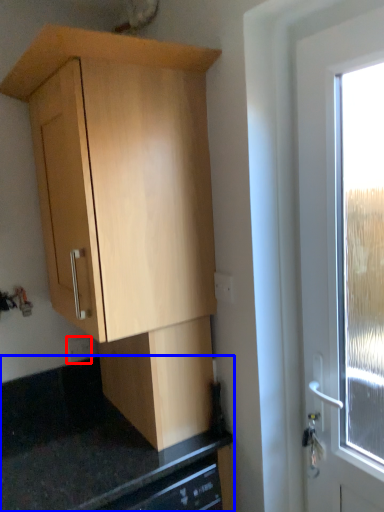
Question: Which point is further to the camera, electric outlet (highlighted by a red box) or counter top (highlighted by a blue box)?

Choices:
 (A) electric outlet
 (B) counter top

Answer: (A)